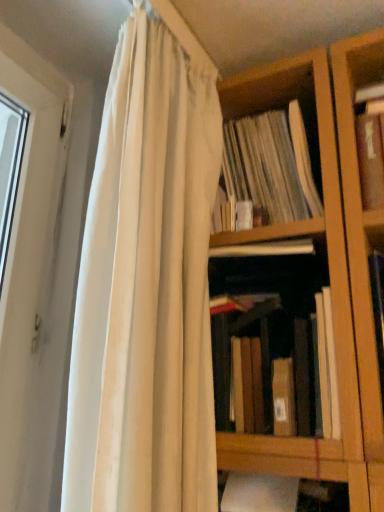
Question: From the image's perspective, is white cotton curtain at upper left above or below brown matte book at center?

Choices:
 (A) above
 (B) below

Answer: (A)

Question: Considering their positions, is white cotton curtain at upper left located in front of or behind brown matte book at center?

Choices:
 (A) front
 (B) behind

Answer: (A)

Question: From their relative heights in the image, would you say white cotton curtain at upper left is taller or shorter than brown matte book at center?

Choices:
 (A) tall
 (B) short

Answer: (A)

Question: Based on their positions, is brown matte book at center located to the left or right of white cotton curtain at upper left?

Choices:
 (A) left
 (B) right

Answer: (B)

Question: Considering the positions of brown matte book at center and white cotton curtain at upper left in the image, is brown matte book at center wider or thinner than white cotton curtain at upper left?

Choices:
 (A) wide
 (B) thin

Answer: (A)

Question: From a real-world perspective, is brown matte book at center above or below white cotton curtain at upper left?

Choices:
 (A) below
 (B) above

Answer: (A)

Question: Choose the correct answer: Is brown matte book at center inside white cotton curtain at upper left or outside it?

Choices:
 (A) inside
 (B) outside

Answer: (B)